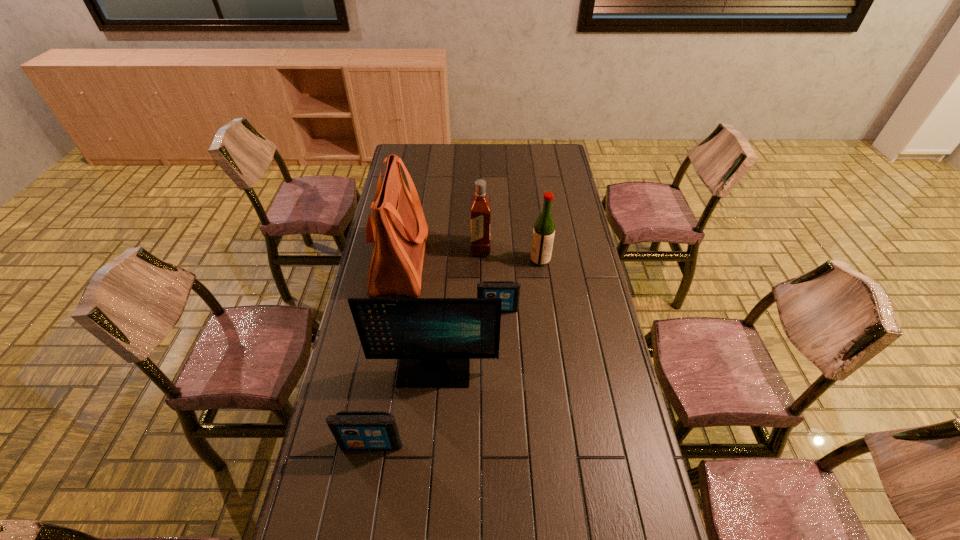
Identify the location of vacant space that satisfies the following two spatial constraints: 1. on the label of the rightmost object; 2. on the screen side of the monitor. The width and height of the screenshot is (960, 540). (555, 369).

Where is `vacant space that satisfies the following two spatial constraints: 1. on the label of the right liquor; 2. on the screen side of the monitor`? vacant space that satisfies the following two spatial constraints: 1. on the label of the right liquor; 2. on the screen side of the monitor is located at coordinates (555, 369).

Identify the location of free spot that satisfies the following two spatial constraints: 1. on the label of the rightmost object; 2. on the screen side of the second nearest object. (555, 369).